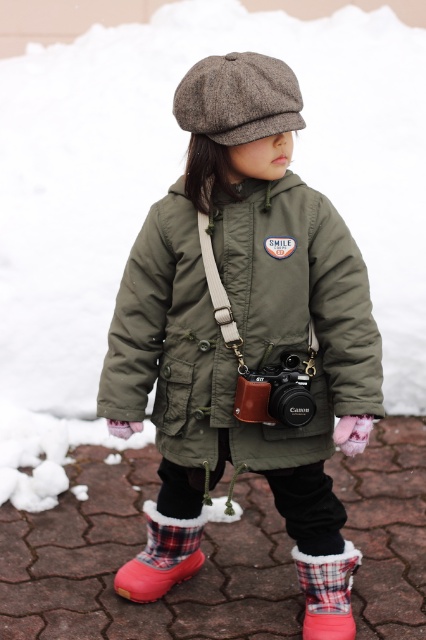
Can you confirm if plaid rubber boot at lower center is positioned to the right of matte black camera at center?

Incorrect, plaid rubber boot at lower center is not on the right side of matte black camera at center.

Which is below, plaid rubber boot at lower center or matte black camera at center?

Positioned lower is plaid rubber boot at lower center.

The width and height of the screenshot is (426, 640). Describe the element at coordinates (161, 556) in the screenshot. I see `plaid rubber boot at lower center` at that location.

I want to click on plaid rubber boot at lower center, so click(x=161, y=556).

Is olive green fabric jacket at center above plaid rubber boot at lower center?

Correct, olive green fabric jacket at center is located above plaid rubber boot at lower center.

The height and width of the screenshot is (640, 426). Find the location of `olive green fabric jacket at center`. olive green fabric jacket at center is located at coordinates coord(241,323).

Who is positioned more to the left, olive green fabric jacket at center or brown wool beret at center?

olive green fabric jacket at center

Is olive green fabric jacket at center to the left of brown wool beret at center from the viewer's perspective?

Correct, you'll find olive green fabric jacket at center to the left of brown wool beret at center.

Which is behind, point (276, 221) or point (210, 86)?

The point (276, 221) is behind.

Identify the location of olive green fabric jacket at center. The width and height of the screenshot is (426, 640). (241, 323).